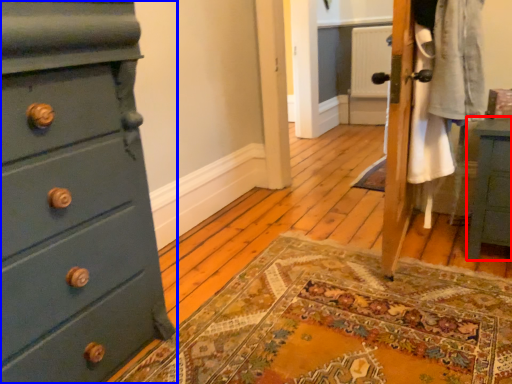
Question: Which object is further to the camera taking this photo, nightstand (highlighted by a red box) or chest of drawers (highlighted by a blue box)?

Choices:
 (A) nightstand
 (B) chest of drawers

Answer: (A)